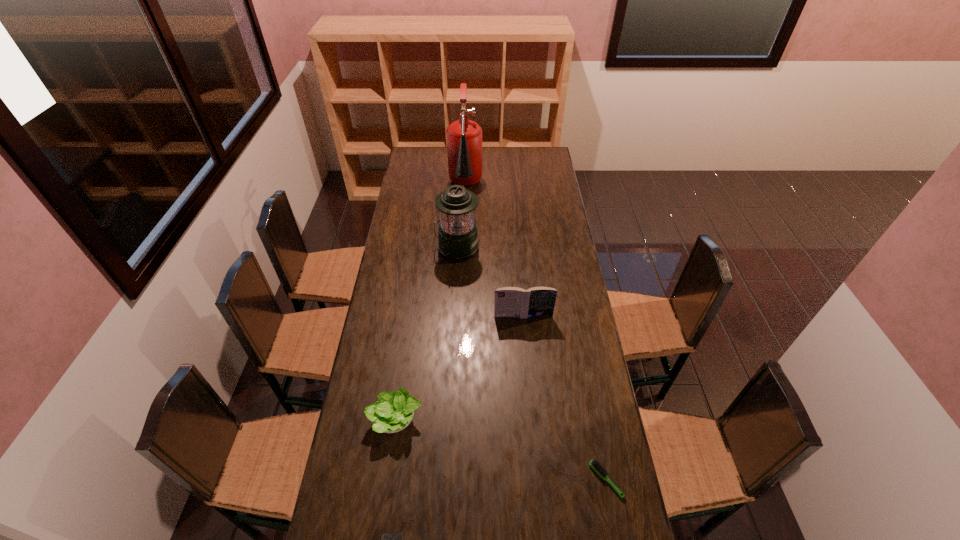
Where is `fire extinguisher`? This screenshot has height=540, width=960. fire extinguisher is located at coordinates (464, 137).

The image size is (960, 540). Find the location of `the farthest object`. the farthest object is located at coordinates (464, 137).

Find the location of a particular element. lantern is located at coordinates (457, 237).

I want to click on the second tallest object, so click(x=457, y=237).

Where is `the fifth object from left to right`? The image size is (960, 540). the fifth object from left to right is located at coordinates (509, 301).

At what (x,y) coordinates should I click in order to perform the action: click on the fourth nearest object. Please return your answer as a coordinate pair (x, y). The height and width of the screenshot is (540, 960). Looking at the image, I should click on (509, 301).

You are a GUI agent. You are given a task and a screenshot of the screen. Output one action in this format:
    pyautogui.click(x=<x>, y=<y>)
    Task: Click on the third nearest object
    The width and height of the screenshot is (960, 540).
    Given the screenshot: What is the action you would take?
    pyautogui.click(x=393, y=412)

This screenshot has height=540, width=960. Find the location of `the fourth tallest object`. the fourth tallest object is located at coordinates (393, 412).

What are the coordinates of `the rightmost object` in the screenshot? It's located at pyautogui.click(x=594, y=464).

Where is `the fifth farthest object`? the fifth farthest object is located at coordinates (594, 464).